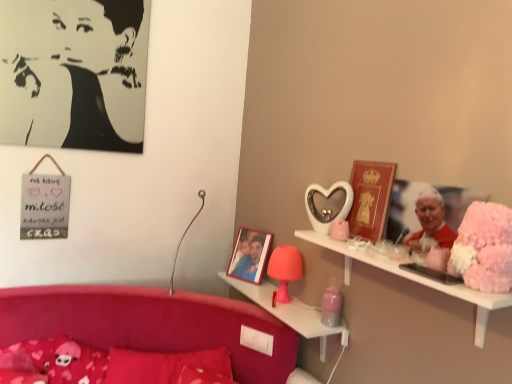
Question: In terms of height, does white matte shelf at upper right, arranged as the 1th shelf when viewed from the front, look taller or shorter compared to black paper portrait at upper left?

Choices:
 (A) tall
 (B) short

Answer: (B)

Question: From a real-world perspective, is white matte shelf at upper right, which ranks as the second shelf in bottom-to-top order, positioned above or below black paper portrait at upper left?

Choices:
 (A) above
 (B) below

Answer: (B)

Question: Estimate the real-world distances between objects in this image. Which object is closer to the velvet red pillow at lower left, the 2th pillow viewed from the left?

Choices:
 (A) black paper portrait at upper left
 (B) metallic silver table lamp at center, which is the first table lamp in left-to-right order
 (C) white matte shelf at upper right, acting as the first shelf starting from the top
 (D) matte pink lamp at center, the 2th shelf in the front-to-back sequence
 (E) fluffy pink pillow at lower left, which ranks as the second pillow in right-to-left order

Answer: (E)

Question: Estimate the real-world distances between objects in this image. Which object is farther from the velvet red pillow at lower left, the 2th pillow viewed from the left?

Choices:
 (A) metallic silver table lamp at center, which is the first table lamp in left-to-right order
 (B) white matte shelf at upper right, marked as the second shelf in a back-to-front arrangement
 (C) fluffy pink pillow at lower left, the 1th pillow positioned from the left
 (D) black paper portrait at upper left
 (E) matte pink lamp at center, the 2th shelf in the front-to-back sequence

Answer: (D)